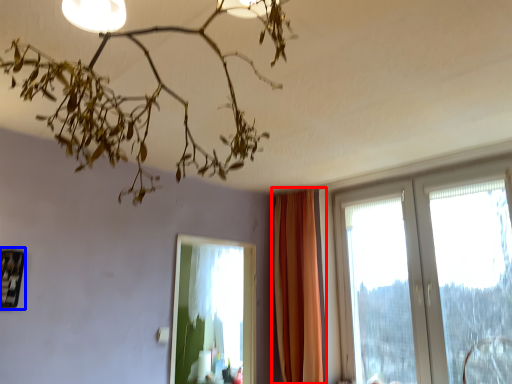
Question: Which object is further to the camera taking this photo, curtain (highlighted by a red box) or picture frame (highlighted by a blue box)?

Choices:
 (A) curtain
 (B) picture frame

Answer: (A)